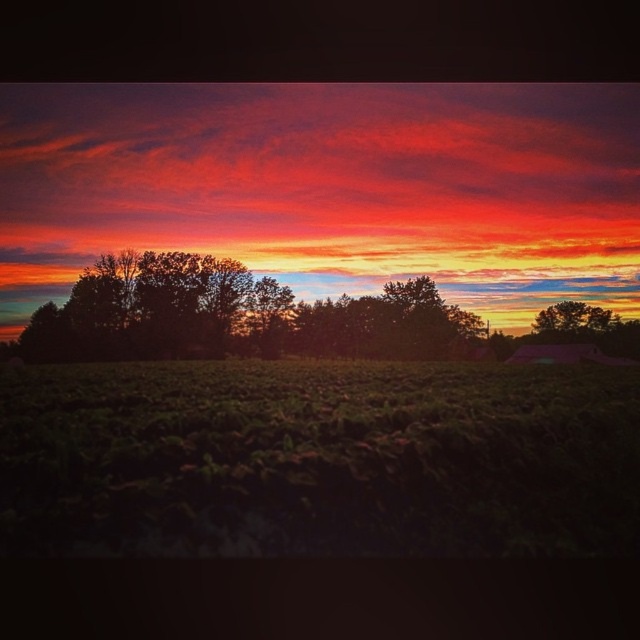
Question: Considering the relative positions of vivid orange cloud at upper center and green leafy tree at right in the image provided, where is vivid orange cloud at upper center located with respect to green leafy tree at right?

Choices:
 (A) above
 (B) below

Answer: (A)

Question: Among these points, which one is farthest from the camera?

Choices:
 (A) (280, 385)
 (B) (304, 115)

Answer: (B)

Question: Is dark green grass at lower center to the right of green leafy tree at right from the viewer's perspective?

Choices:
 (A) yes
 (B) no

Answer: (B)

Question: From the image, what is the correct spatial relationship of vivid orange cloud at upper center in relation to green leafy tree at right?

Choices:
 (A) right
 (B) left

Answer: (B)

Question: Which object is positioned farthest from the dark green grass at lower center?

Choices:
 (A) vivid orange cloud at upper center
 (B) green leafy tree at right

Answer: (B)

Question: Which of these objects is positioned farthest from the dark green grass at lower center?

Choices:
 (A) green leafy tree at right
 (B) vivid orange cloud at upper center

Answer: (A)